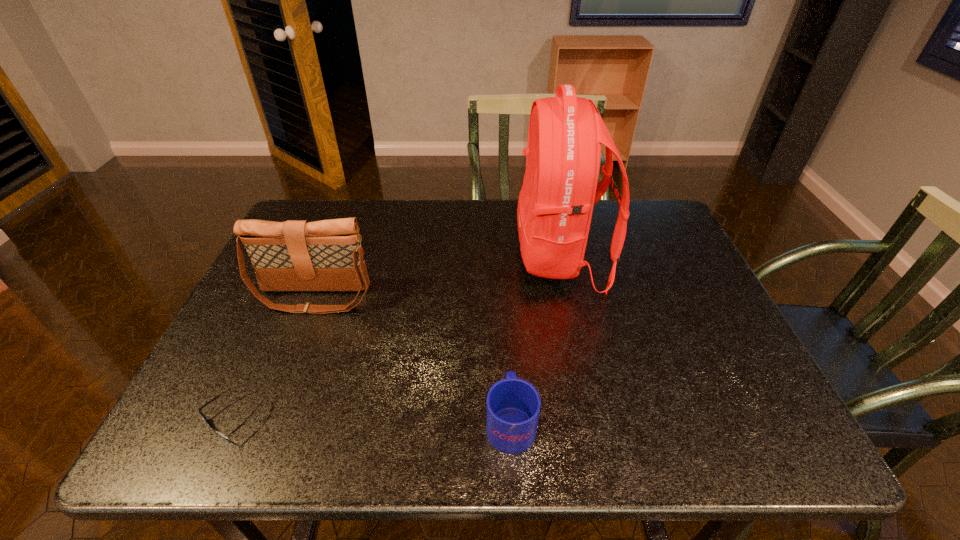
The height and width of the screenshot is (540, 960). In order to click on vacant space located on the side with the handle of the mug in this screenshot , I will do click(x=503, y=294).

The image size is (960, 540). I want to click on object situated at the far edge, so click(559, 190).

Find the location of a particular element. This screenshot has width=960, height=540. mug present at the near edge is located at coordinates (513, 405).

Where is `sunglasses that is at the near edge`? sunglasses that is at the near edge is located at coordinates (203, 416).

Image resolution: width=960 pixels, height=540 pixels. I want to click on shoulder bag at the left edge, so click(x=296, y=255).

Where is `sunglasses located at the left edge`? sunglasses located at the left edge is located at coordinates (203, 416).

What are the coordinates of `object that is at the near left corner` in the screenshot? It's located at (203, 416).

I want to click on vacant space at the far edge, so click(x=429, y=214).

At what (x,y) coordinates should I click in order to perform the action: click on vacant space at the near edge of the desktop. Please return your answer as a coordinate pair (x, y). Image resolution: width=960 pixels, height=540 pixels. Looking at the image, I should click on (483, 421).

At what (x,y) coordinates should I click in order to perform the action: click on free space at the left edge of the desktop. Please return your answer as a coordinate pair (x, y). The image size is (960, 540). Looking at the image, I should click on (245, 301).